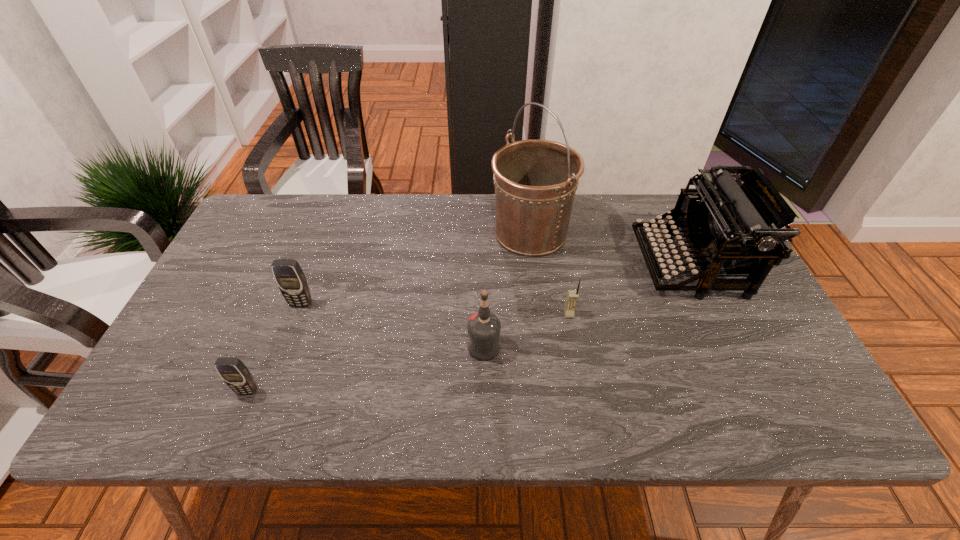
Find the location of a particular element. the third closest object to the farthest cellular telephone is located at coordinates (535, 181).

Select which cellular telephone appears as the second closest to the bucket. Please provide its 2D coordinates. Your answer should be formatted as a tuple, i.e. [(x, y)], where the tuple contains the x and y coordinates of a point satisfying the conditions above.

[(290, 278)]

Find the location of a particular element. cellular telephone that is the second closest to the farthest cellular telephone is located at coordinates (572, 297).

Where is `vacant space that satisfies the following two spatial constraints: 1. on the front of the third nearest object, where the keypad is located; 2. on the front label of the third tallest object`? This screenshot has width=960, height=540. vacant space that satisfies the following two spatial constraints: 1. on the front of the third nearest object, where the keypad is located; 2. on the front label of the third tallest object is located at coordinates (575, 348).

This screenshot has height=540, width=960. Find the location of `free space that satisfies the following two spatial constraints: 1. on the front side of the bucket; 2. on the front label of the third tallest object`. free space that satisfies the following two spatial constraints: 1. on the front side of the bucket; 2. on the front label of the third tallest object is located at coordinates (544, 348).

Where is `free region that satisfies the following two spatial constraints: 1. on the front label of the third tallest object; 2. on the front face of the nearest object`? Image resolution: width=960 pixels, height=540 pixels. free region that satisfies the following two spatial constraints: 1. on the front label of the third tallest object; 2. on the front face of the nearest object is located at coordinates (484, 391).

What are the coordinates of `vacant position in the image that satisfies the following two spatial constraints: 1. on the typing side of the second tallest object; 2. on the front of the rightmost cellular telephone, where the keypad is located` in the screenshot? It's located at (713, 314).